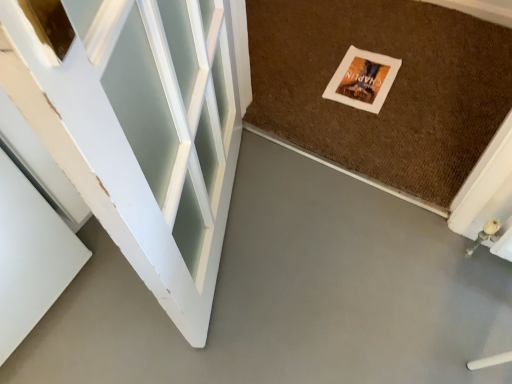
Locate an element on the screen. vacant area that is in front of matte paper postcard at center is located at coordinates (379, 127).